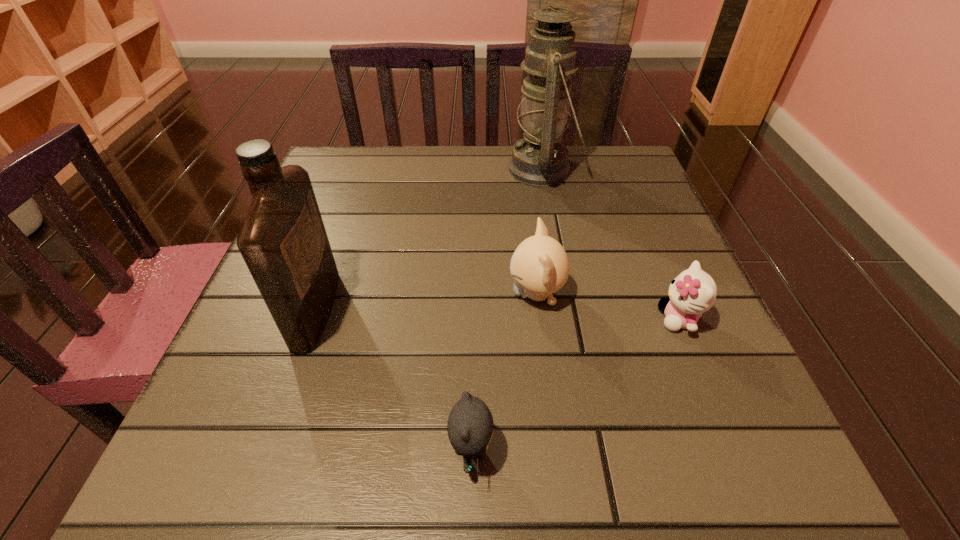
Find the location of a particular element. This screenshot has height=540, width=960. vacant point located between the liquor and the second kitten from left to right is located at coordinates (426, 301).

Find the location of a particular element. empty location between the leftmost kitten and the second tallest object is located at coordinates (394, 380).

I want to click on free space between the rightmost object and the second kitten from left to right, so pos(608,306).

At what (x,y) coordinates should I click in order to perform the action: click on free space between the rightmost kitten and the third tallest object. Please return your answer as a coordinate pair (x, y). This screenshot has height=540, width=960. Looking at the image, I should click on (608, 306).

Find the location of `empty space that is in between the farthest object and the rightmost kitten`. empty space that is in between the farthest object and the rightmost kitten is located at coordinates (611, 244).

This screenshot has width=960, height=540. Find the location of `vacant region between the liquor and the farthest object`. vacant region between the liquor and the farthest object is located at coordinates (429, 239).

You are a GUI agent. You are given a task and a screenshot of the screen. Output one action in this format:
    pyautogui.click(x=<x>, y=<y>)
    Task: Click on the blank region between the rightmost object and the nearest object
    
    Given the screenshot: What is the action you would take?
    pyautogui.click(x=575, y=384)

Where is `vacant space in between the leftmost kitten and the fourth shortest object`? Image resolution: width=960 pixels, height=540 pixels. vacant space in between the leftmost kitten and the fourth shortest object is located at coordinates (394, 380).

Select which object is the second closest to the farthest object. Please provide its 2D coordinates. Your answer should be formatted as a tuple, i.e. [(x, y)], where the tuple contains the x and y coordinates of a point satisfying the conditions above.

[(693, 292)]

Locate an element on the screen. The width and height of the screenshot is (960, 540). object that is the fourth closest to the rightmost object is located at coordinates (283, 241).